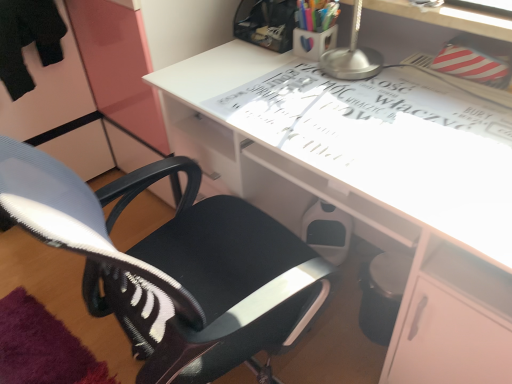
Find the location of a particular element. Image resolution: width=512 pixels, height=384 pixels. free space to the left of matte plastic cup at upper center, the first stationery in the bottom-to-top sequence is located at coordinates (265, 63).